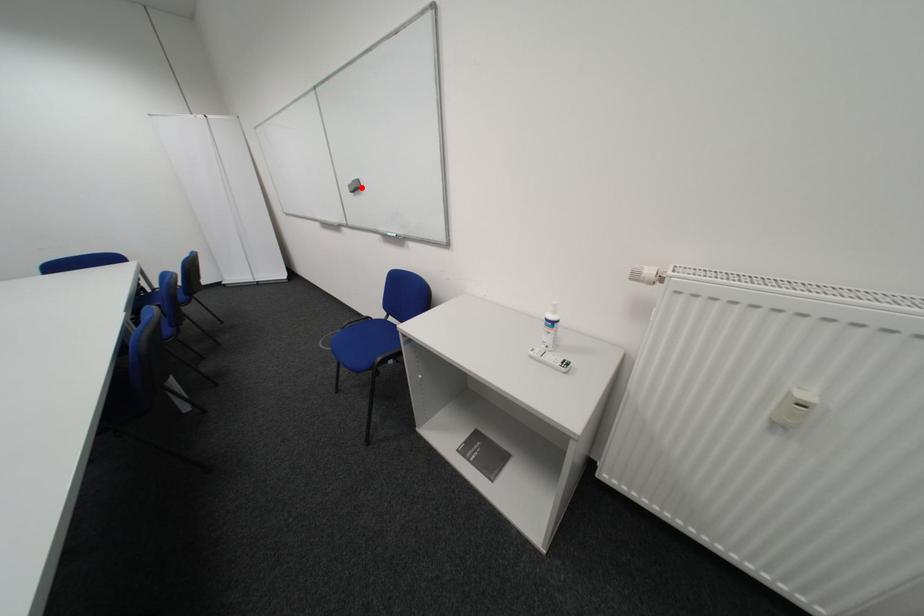
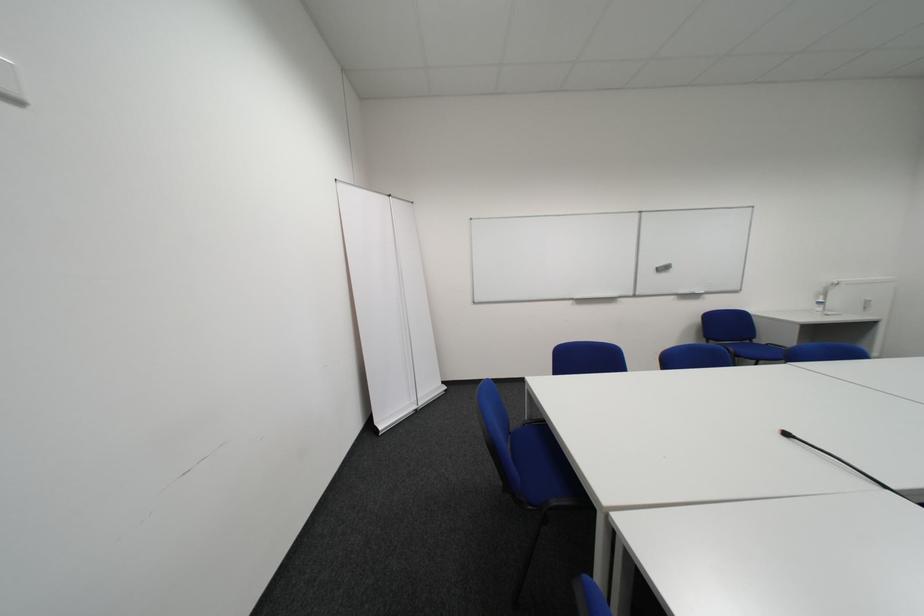
Locate, in the second image, the point that corresponds to the highlighted location in the first image.

(669, 270)